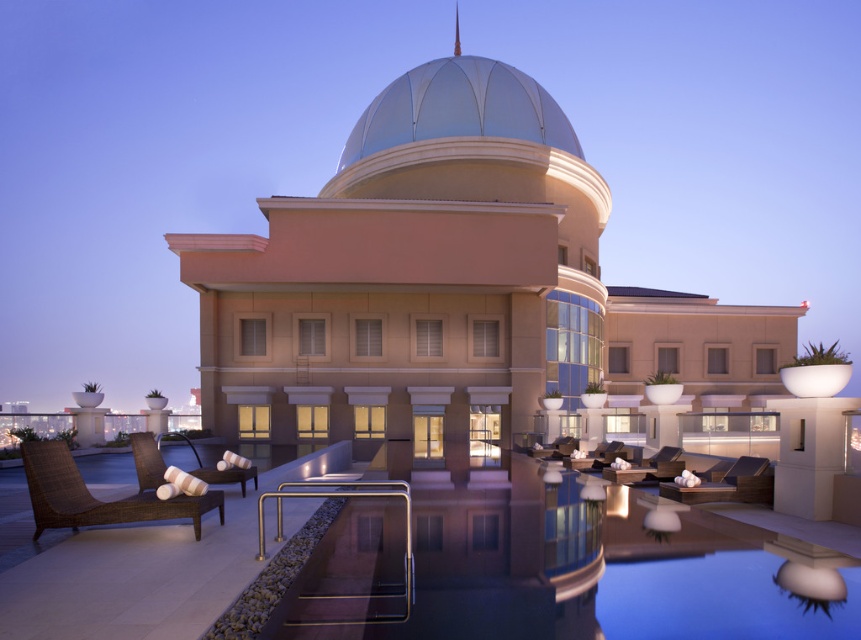
You are planning to install a new lighting fixture above the dark brown wicker lounge chair at center. Considering the size of the metallic silver dome at center, will the dome obstruct the installation? Please explain your reasoning based on their sizes.

The metallic silver dome at center is bigger than the dark brown wicker lounge chair at center. Since the dome is larger, it may obstruct the installation of the lighting fixture above the lounge chair depending on their vertical positioning. However, the description only provides information about their sizes, not their exact vertical positions, so further details would be needed to confirm obstruction.